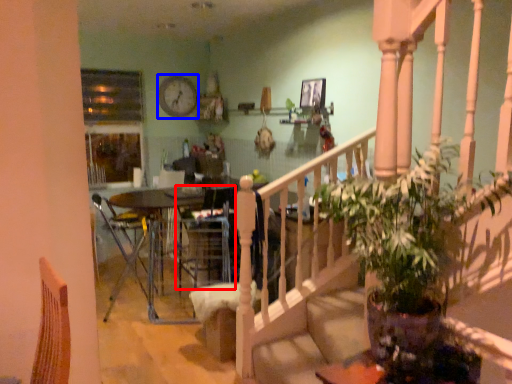
Question: Which of the following is the farthest to the observer, armchair (highlighted by a red box) or clock (highlighted by a blue box)?

Choices:
 (A) armchair
 (B) clock

Answer: (B)